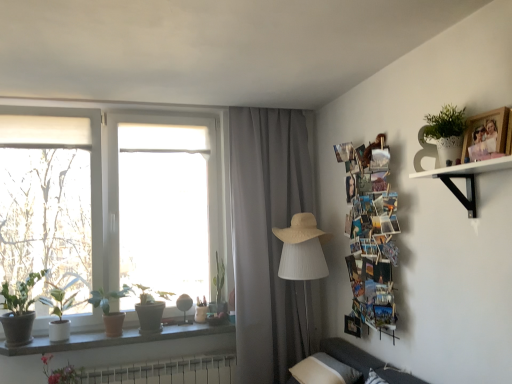
Image resolution: width=512 pixels, height=384 pixels. Describe the element at coordinates (113, 339) in the screenshot. I see `granite window sill at lower left` at that location.

This screenshot has height=384, width=512. What do you see at coordinates (168, 372) in the screenshot? I see `white plastic radiator at lower center` at bounding box center [168, 372].

The image size is (512, 384). I want to click on gray fabric curtain at center, so click(268, 240).

Which is behind, white matte shelf at upper right or white ribbed fabric lampshade at center?

Positioned behind is white ribbed fabric lampshade at center.

Considering the sizes of white matte shelf at upper right and white ribbed fabric lampshade at center in the image, is white matte shelf at upper right bigger or smaller than white ribbed fabric lampshade at center?

In the image, white matte shelf at upper right appears to be smaller than white ribbed fabric lampshade at center.

Considering the points (469, 214) and (289, 258), which point is in front, point (469, 214) or point (289, 258)?

Point (469, 214)

From a real-world perspective, who is located higher, white matte shelf at upper right or white ribbed fabric lampshade at center?

white matte shelf at upper right is physically above.

Which of these two, green matte plant at window, acting as the 4th houseplant starting from the left, or beige straw hat at center, is thinner?

green matte plant at window, acting as the 4th houseplant starting from the left, is thinner.

Are green matte plant at window, arranged as the second houseplant when viewed from the right, and beige straw hat at center beside each other?

They are not placed beside each other.

Locate an element on the screen. straw hat behind the green matte plant at window, acting as the 4th houseplant starting from the left is located at coordinates (301, 230).

From a real-world perspective, does green matte plant at window, arranged as the second houseplant when viewed from the right, stand above beige straw hat at center?

Incorrect, from a real-world perspective, green matte plant at window, arranged as the second houseplant when viewed from the right, is lower than beige straw hat at center.

Which is less distant, (304,223) or (156,366)?

Point (304,223) is farther from the camera than point (156,366).

Can you see beige straw hat at center touching white plastic radiator at lower center?

There is a gap between beige straw hat at center and white plastic radiator at lower center.

Looking at this image, is beige straw hat at center smaller than white plastic radiator at lower center?

Answer: Indeed, beige straw hat at center has a smaller size compared to white plastic radiator at lower center.

Considering the relative positions of beige straw hat at center and white plastic radiator at lower center in the image provided, is beige straw hat at center in front of white plastic radiator at lower center?

No, beige straw hat at center is behind white plastic radiator at lower center.

Can you tell me how much beige straw hat at center and white matte shelf at upper right differ in facing direction?

4.84 degrees.

Which of these two, beige straw hat at center or white matte shelf at upper right, is smaller?

white matte shelf at upper right is smaller.

Considering the sizes of objects beige straw hat at center and white matte shelf at upper right in the image provided, who is taller, beige straw hat at center or white matte shelf at upper right?

beige straw hat at center is taller.

From a real-world perspective, which is physically above, beige straw hat at center or white matte shelf at upper right?

A: white matte shelf at upper right, from a real-world perspective.

Which is behind, point (2, 286) or point (124, 341)?

The point (124, 341) is farther from the camera.

From the image's perspective, which object appears higher, green matte plant at lower left, which ranks as the fifth houseplant in right-to-left order, or granite window sill at lower left?

From the image's view, green matte plant at lower left, which ranks as the fifth houseplant in right-to-left order, is above.

Considering the relative positions of green matte plant at lower left, which ranks as the fifth houseplant in right-to-left order, and granite window sill at lower left in the image provided, is green matte plant at lower left, which ranks as the fifth houseplant in right-to-left order, to the left or to the right of granite window sill at lower left?

Based on their positions, green matte plant at lower left, which ranks as the fifth houseplant in right-to-left order, is located to the left of granite window sill at lower left.

How many degrees apart are the facing directions of green matte plant at lower left, which ranks as the fifth houseplant in right-to-left order, and granite window sill at lower left?

They differ by 0.572 degrees in their facing directions.

From a real-world perspective, is green matte plant at lower left, which ranks as the fifth houseplant in right-to-left order, over wooden photo collage at upper right?

Actually, green matte plant at lower left, which ranks as the fifth houseplant in right-to-left order, is physically below wooden photo collage at upper right in the real world.

Is point (32, 301) behind point (354, 164)?

No, (32, 301) is in front of (354, 164).

How many degrees apart are the facing directions of green matte plant at lower left, which ranks as the fifth houseplant in right-to-left order, and wooden photo collage at upper right?

The angle between the facing direction of green matte plant at lower left, which ranks as the fifth houseplant in right-to-left order, and the facing direction of wooden photo collage at upper right is 90 degrees.

Between green matte plant at lower left, which ranks as the fifth houseplant in right-to-left order, and wooden photo collage at upper right, which one appears on the right side from the viewer's perspective?

From the viewer's perspective, wooden photo collage at upper right appears more on the right side.

Considering the relative sizes of wooden photo frame at upper right and pink matte flower at lower left in the image provided, is wooden photo frame at upper right smaller than pink matte flower at lower left?

Yes.

From the image's perspective, which is below, wooden photo frame at upper right or pink matte flower at lower left?

pink matte flower at lower left, from the image's perspective.

Would you say wooden photo frame at upper right is outside pink matte flower at lower left?

Yes, wooden photo frame at upper right is located beyond the bounds of pink matte flower at lower left.

Can you confirm if wooden photo frame at upper right is wider than pink matte flower at lower left?

In fact, wooden photo frame at upper right might be narrower than pink matte flower at lower left.

At what (x,y) coordinates should I click in order to perform the action: click on shelf located on the right of white ribbed fabric lampshade at center. Please return your answer as a coordinate pair (x, y). Looking at the image, I should click on (466, 178).

Locate an element on the screen. straw hat above the green matte plant at window, acting as the 4th houseplant starting from the left (from a real-world perspective) is located at coordinates point(301,230).

Estimate the real-world distances between objects in this image. Which object is closer to wooden photo frame at upper right, green matte plant at lower left, which ranks as the fifth houseplant in right-to-left order, or white ribbed fabric lampshade at center?

Based on the image, white ribbed fabric lampshade at center appears to be nearer to wooden photo frame at upper right.

From the image, which object appears to be nearer to green matte plant at window, arranged as the second houseplant when viewed from the right, granite window sill at lower left or white textured pot at upper right, acting as the fifth houseplant starting from the left?

granite window sill at lower left is closer to green matte plant at window, arranged as the second houseplant when viewed from the right.

Based on their spatial positions, is gray fabric curtain at center or white matte shelf at upper right further from white textured pot at upper right, acting as the fifth houseplant starting from the left?

gray fabric curtain at center.

Looking at the image, which one is located further to green matte plant at lower left, which ranks as the fifth houseplant in right-to-left order, wooden photo frame at upper right or white plastic radiator at lower center?

wooden photo frame at upper right is further to green matte plant at lower left, which ranks as the fifth houseplant in right-to-left order.

Considering their positions, is white plastic radiator at lower center positioned closer to pink matte flower at lower left than white matte shelf at upper right?

white plastic radiator at lower center.

Which object lies nearer to the anchor point white textured pot at upper right, acting as the fifth houseplant starting from the left, wooden photo collage at upper right or white ribbed fabric lampshade at center?

Based on the image, wooden photo collage at upper right appears to be nearer to white textured pot at upper right, acting as the fifth houseplant starting from the left.

Estimate the real-world distances between objects in this image. Which object is further from granite window sill at lower left, white matte shelf at upper right or wooden photo collage at upper right?

white matte shelf at upper right is further to granite window sill at lower left.

Which object lies nearer to the anchor point white plastic radiator at lower center, green matte plant at left, positioned as the 2th houseplant in left-to-right order, or white ribbed fabric lampshade at center?

green matte plant at left, positioned as the 2th houseplant in left-to-right order.

Image resolution: width=512 pixels, height=384 pixels. Find the location of `houseplant located between white plastic radiator at lower center and gray fabric curtain at center in the left-right direction`. houseplant located between white plastic radiator at lower center and gray fabric curtain at center in the left-right direction is located at coordinates (149, 311).

Find the location of a particular element. radiator between pink matte flower at lower left and beige straw hat at center is located at coordinates tap(168, 372).

Find the location of a particular element. The image size is (512, 384). window sill between green matte plant at window, acting as the 4th houseplant starting from the left, and white plastic radiator at lower center, in the vertical direction is located at coordinates (113, 339).

Find the location of a particular element. This screenshot has height=384, width=512. curtain located between green matte plant at lower left, positioned as the 1th houseplant in left-to-right order, and wooden photo collage at upper right in the left-right direction is located at coordinates tap(268, 240).